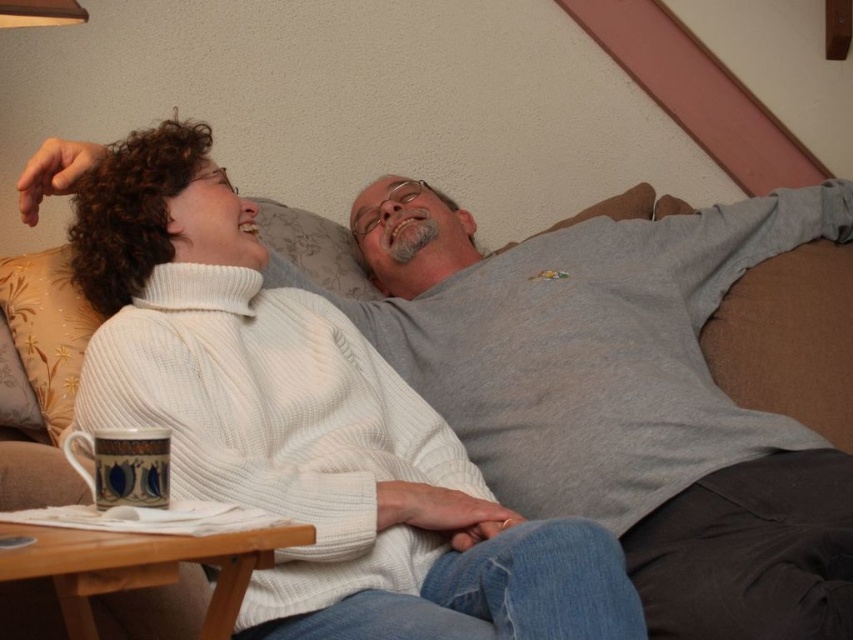
You are a delivery person who needs to place a small package between the dark gray fabric at lower right and the blue and white ceramic mug at lower left. Can you fit the package there?

The dark gray fabric at lower right is wider than the blue and white ceramic mug at lower left, so the space between them may be sufficient to fit a small package. However, the exact dimensions of the space aren

You are a guest in this living room and want to place a new decorative item between the dark gray fabric at lower right and the blue and white ceramic mug at lower left. Considering their heights, which object should the decorative item be placed closer to?

The dark gray fabric at lower right is taller than the blue and white ceramic mug at lower left. To ensure the decorative item is visible between them, it should be placed closer to the shorter blue and white ceramic mug at lower left so it doesn

You are standing in front of the couch where the two people are lying. You want to place a small decoration on the couch. The decoration must be placed closer to you than the edge of the couch. Which of the two points, point (756, 627) or point (85, 440), should you choose?

Point (756, 627) is closer to the viewer than point (85, 440), so you should choose point (756, 627) to place the decoration closer to you.